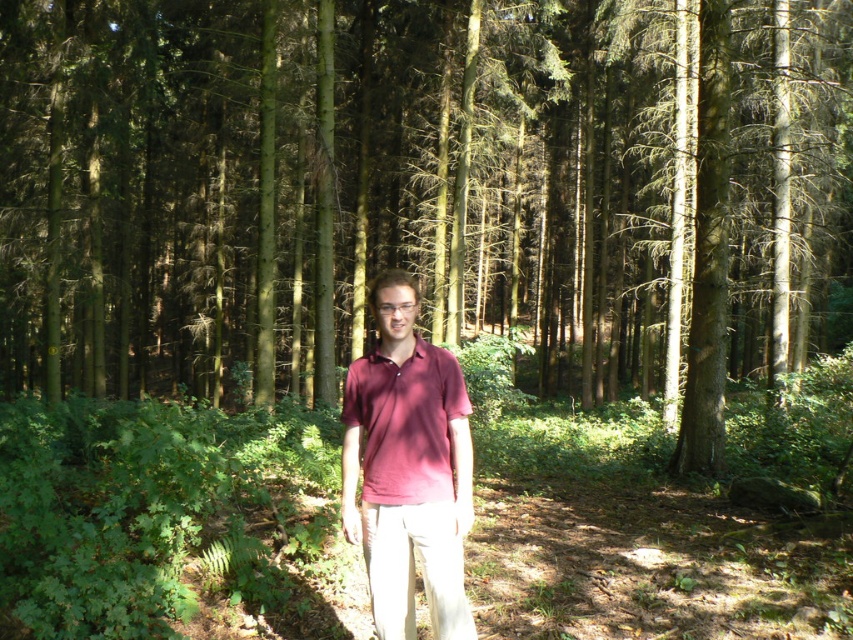
You are a hiker lost in a forest. You see a point marked at coordinates (422,189). According to the map, this point corresponds to a landmark. What is the landmark located at this point?

The landmark at point (422,189) is a green matte tree at center.